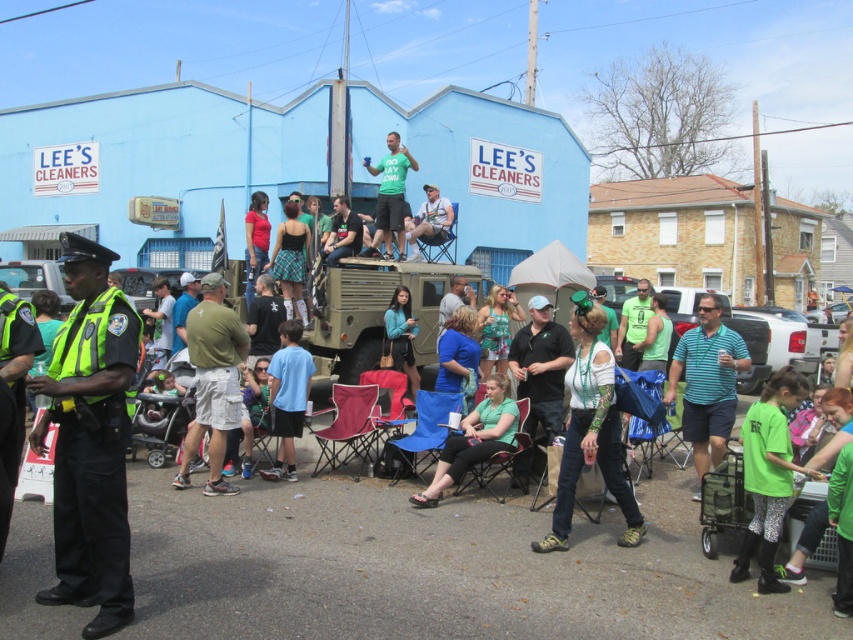
Question: Which point is farther to the camera?

Choices:
 (A) white matte pickup truck at center
 (B) matte green skirt at center

Answer: (B)

Question: Which point is farther to the camera?

Choices:
 (A) (305, 388)
 (B) (65, 557)
 (C) (694, 467)
 (D) (770, 410)

Answer: (A)

Question: Is the position of green matte shirt at lower right more distant than that of light blue fabric chair at center?

Choices:
 (A) no
 (B) yes

Answer: (A)

Question: Considering the relative positions of matte green skirt at center and light blue fabric chair at center in the image provided, where is matte green skirt at center located with respect to light blue fabric chair at center?

Choices:
 (A) below
 (B) above

Answer: (A)

Question: Is the position of white matte pickup truck at center less distant than that of light blue fabric chair at center?

Choices:
 (A) no
 (B) yes

Answer: (B)

Question: Which object is positioned closest to the blue cotton shirt at center?

Choices:
 (A) matte green skirt at center
 (B) light blue fabric chair at center
 (C) green reflective vest at left
 (D) teal fabric jacket at center

Answer: (A)